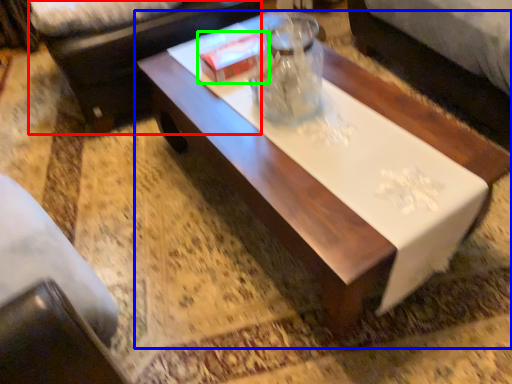
Question: Which is nearer to the couch (highlighted by a red box)? coffee table (highlighted by a blue box) or box (highlighted by a green box).

Choices:
 (A) coffee table
 (B) box

Answer: (B)